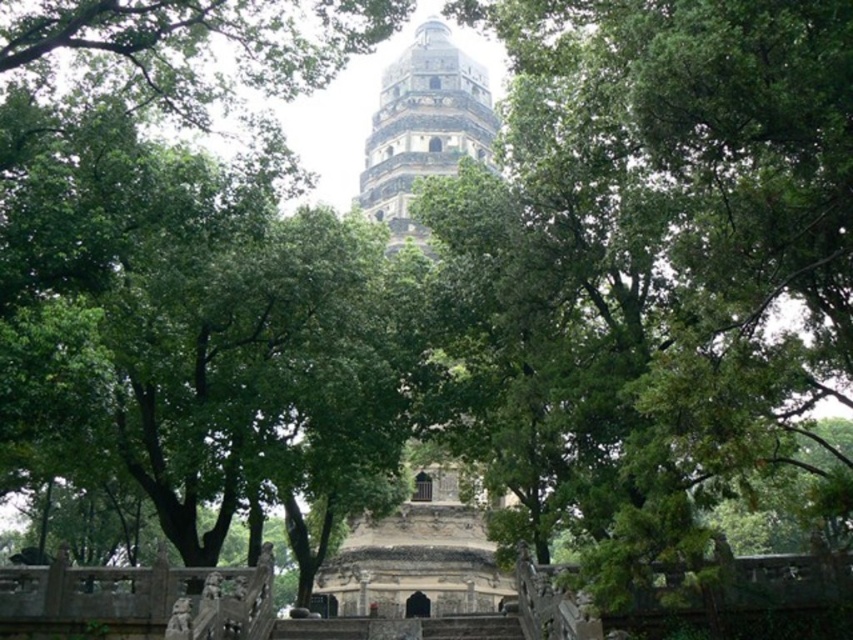
How distant is stone tower at center from gray stone tower at center?

The distance of stone tower at center from gray stone tower at center is 3.48 meters.

Can you confirm if stone tower at center is wider than gray stone tower at center?

No.

Is point (442, 525) positioned before point (456, 150)?

Yes, point (442, 525) is in front of point (456, 150).

Identify the location of stone tower at center. This screenshot has height=640, width=853. (422, 128).

Is gray stone tower at center shorter than dark gray stone stairs at center?

In fact, gray stone tower at center may be taller than dark gray stone stairs at center.

Does gray stone tower at center have a greater height compared to dark gray stone stairs at center?

Yes, gray stone tower at center is taller than dark gray stone stairs at center.

Is point (405, 193) more distant than point (315, 625)?

Yes, point (405, 193) is behind point (315, 625).

This screenshot has height=640, width=853. I want to click on gray stone tower at center, so (x=422, y=128).

Can you confirm if stone tower at center is positioned to the right of dark gray stone stairs at center?

No, stone tower at center is not to the right of dark gray stone stairs at center.

Is point (431, 67) positioned after point (323, 632)?

Yes, point (431, 67) is behind point (323, 632).

Where is `stone tower at center`? This screenshot has width=853, height=640. stone tower at center is located at coordinates (422, 128).